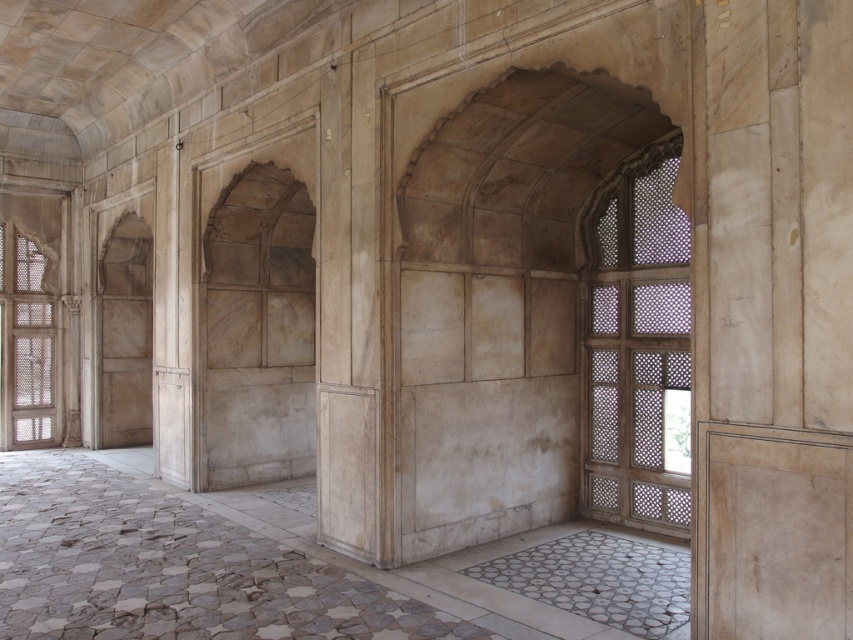
You are an architect visiting this Mughal architectural space. You notice the translucent wood lattice at right. Where exactly is it located in the image?

The translucent wood lattice at right is located at point (x=637, y=349) in the image.